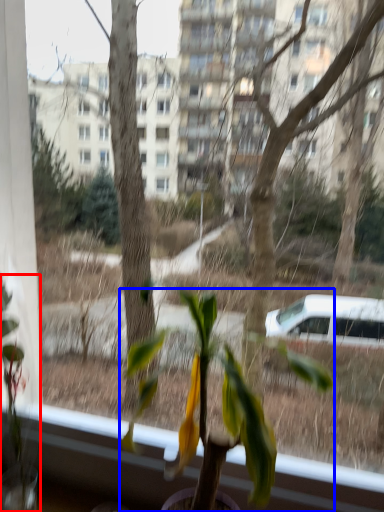
Question: Which object is further to the camera taking this photo, houseplant (highlighted by a red box) or houseplant (highlighted by a blue box)?

Choices:
 (A) houseplant
 (B) houseplant

Answer: (A)